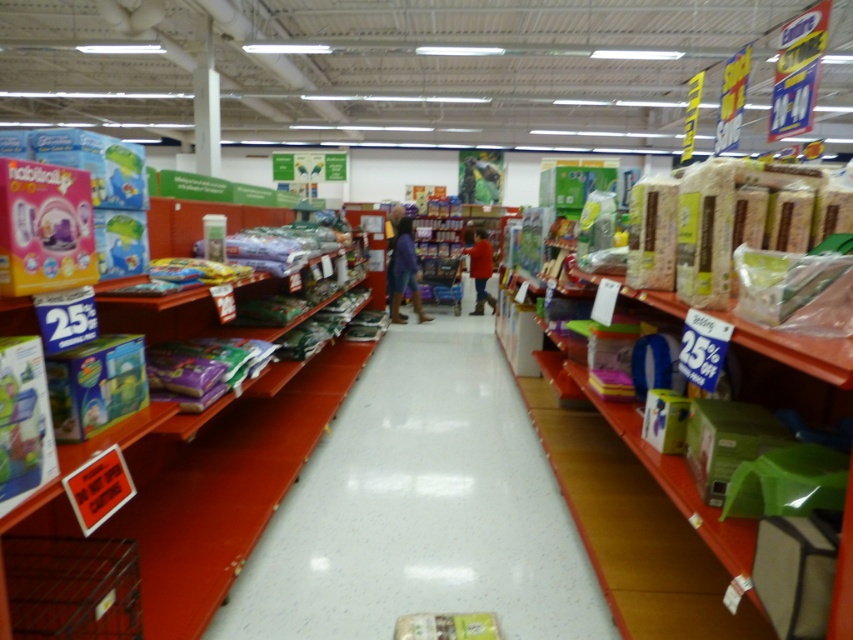
Question: Which of the following is the farthest from the observer?

Choices:
 (A) (407, 282)
 (B) (474, 230)
 (C) (428, 444)

Answer: (B)

Question: Is shiny plastic aisle at center above blue fabric pants at center?

Choices:
 (A) no
 (B) yes

Answer: (A)

Question: Observing the image, what is the correct spatial positioning of blue fabric pants at center in reference to dark brown leather jacket at center?

Choices:
 (A) left
 (B) right

Answer: (B)

Question: From the image, what is the correct spatial relationship of blue fabric pants at center in relation to red sweater at center?

Choices:
 (A) left
 (B) right

Answer: (A)

Question: Which is farther from the blue fabric pants at center?

Choices:
 (A) dark brown leather jacket at center
 (B) red sweater at center
 (C) shiny plastic aisle at center

Answer: (C)

Question: Among these objects, which one is farthest from the camera?

Choices:
 (A) dark brown leather jacket at center
 (B) red sweater at center

Answer: (B)